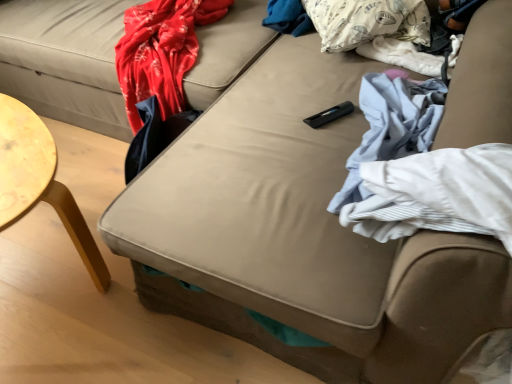
Question: Is white printed pillow at upper right smaller than white fabric at right?

Choices:
 (A) no
 (B) yes

Answer: (A)

Question: Is white printed pillow at upper right completely or partially outside of white fabric at right?

Choices:
 (A) no
 (B) yes

Answer: (B)

Question: Is white printed pillow at upper right bigger than white fabric at right?

Choices:
 (A) no
 (B) yes

Answer: (B)

Question: Is white printed pillow at upper right to the right of white fabric at right from the viewer's perspective?

Choices:
 (A) no
 (B) yes

Answer: (A)

Question: Does white printed pillow at upper right have a greater width compared to white fabric at right?

Choices:
 (A) no
 (B) yes

Answer: (B)

Question: Is white fabric at right completely or partially inside white printed pillow at upper right?

Choices:
 (A) yes
 (B) no

Answer: (B)

Question: From a real-world perspective, is white fabric at right positioned under white printed pillow at upper right based on gravity?

Choices:
 (A) yes
 (B) no

Answer: (A)

Question: Can you confirm if white fabric at right is thinner than white printed pillow at upper right?

Choices:
 (A) no
 (B) yes

Answer: (B)

Question: From the image's perspective, is white fabric at right under white printed pillow at upper right?

Choices:
 (A) yes
 (B) no

Answer: (A)

Question: From a real-world perspective, is white fabric at right located higher than white printed pillow at upper right?

Choices:
 (A) no
 (B) yes

Answer: (A)

Question: Is white fabric at right oriented towards white printed pillow at upper right?

Choices:
 (A) yes
 (B) no

Answer: (B)

Question: Is white fabric at right shorter than white printed pillow at upper right?

Choices:
 (A) yes
 (B) no

Answer: (A)

Question: Considering the positions of point (392, 34) and point (346, 195), is point (392, 34) closer or farther from the camera than point (346, 195)?

Choices:
 (A) farther
 (B) closer

Answer: (A)